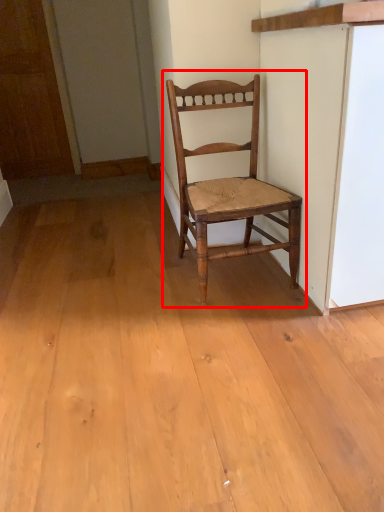
Question: Considering the relative positions of chair (annotated by the red box) and door in the image provided, where is chair (annotated by the red box) located with respect to the staircase?

Choices:
 (A) left
 (B) right

Answer: (B)